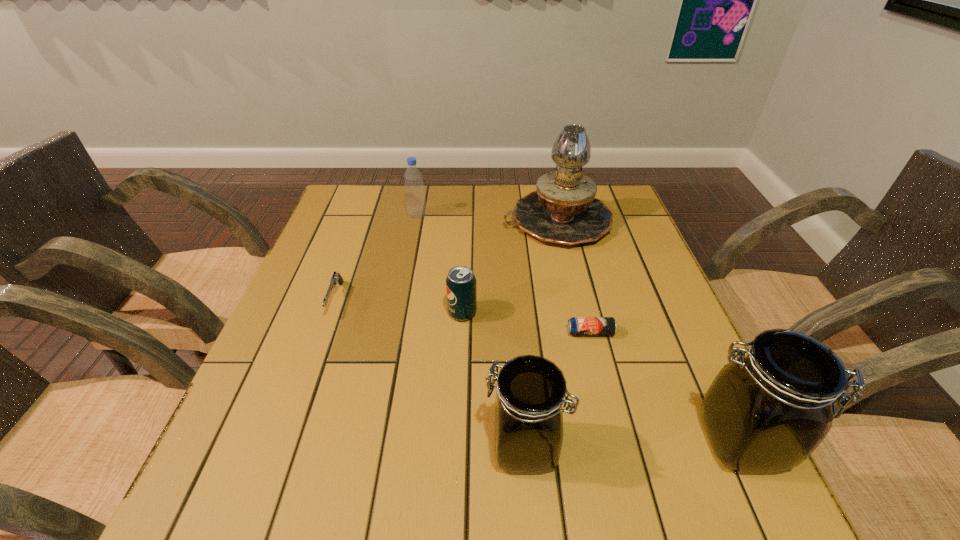
The image size is (960, 540). Identify the location of vacant region at the far left corner. (359, 201).

Locate an element on the screen. free space at the near right corner of the desktop is located at coordinates (660, 429).

Image resolution: width=960 pixels, height=540 pixels. In order to click on empty location between the pistol and the shorter jar in this screenshot , I will do `click(430, 374)`.

Identify the location of vacant point located between the second object from left to right and the sixth tallest object. The height and width of the screenshot is (540, 960). (376, 258).

You are a GUI agent. You are given a task and a screenshot of the screen. Output one action in this format:
    pyautogui.click(x=<x>, y=<y>)
    Task: Click on the vacant area between the leftmost object and the soda can
    
    Given the screenshot: What is the action you would take?
    pyautogui.click(x=399, y=306)

This screenshot has height=540, width=960. I want to click on free spot between the taller jar and the beer can, so click(666, 387).

The width and height of the screenshot is (960, 540). Find the location of `free spot between the shorter jar and the pistol`. free spot between the shorter jar and the pistol is located at coordinates (430, 374).

Image resolution: width=960 pixels, height=540 pixels. I want to click on blank region between the sixth shortest object and the left jar, so click(633, 444).

Identify the location of free point between the leftmost object and the tallest object. (446, 260).

Locate an element on the screen. This screenshot has width=960, height=540. object that is the second closest to the fifth object from right to left is located at coordinates (563, 210).